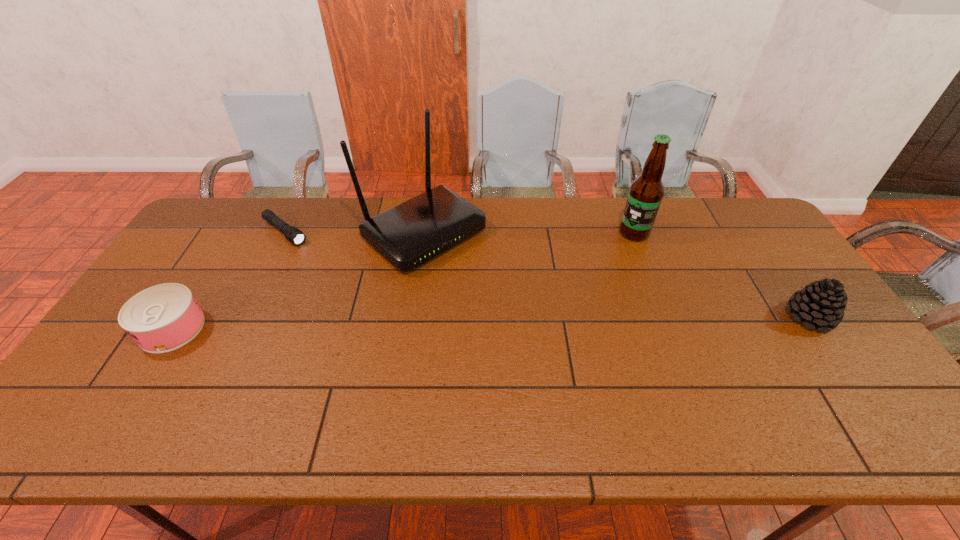
Where is `blank space located on the front-facing side of the router`? This screenshot has height=540, width=960. blank space located on the front-facing side of the router is located at coordinates (489, 283).

I want to click on free space located on the front-facing side of the router, so click(562, 340).

Locate an element on the screen. The height and width of the screenshot is (540, 960). vacant position located 0.120m on the label of the beer bottle is located at coordinates (602, 255).

Identify the location of free space located on the label of the beer bottle. The height and width of the screenshot is (540, 960). (552, 290).

Where is `vacant space located 0.150m on the label of the beer bottle`? vacant space located 0.150m on the label of the beer bottle is located at coordinates (595, 260).

Where is `free space located at the lens end of the shortest object`? The image size is (960, 540). free space located at the lens end of the shortest object is located at coordinates (372, 298).

Where is `free region located at the lens end of the shortest object`? free region located at the lens end of the shortest object is located at coordinates (354, 284).

This screenshot has width=960, height=540. I want to click on vacant region located at the lens end of the shortest object, so click(x=365, y=292).

Locate an element on the screen. router that is at the far edge is located at coordinates (408, 235).

This screenshot has height=540, width=960. In order to click on beer bottle at the far edge in this screenshot , I will do `click(646, 192)`.